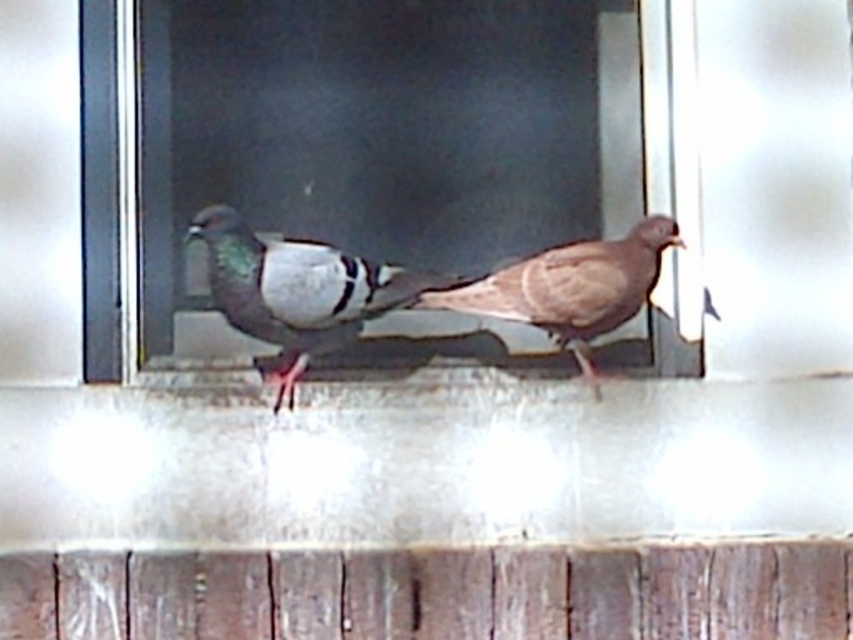
You are a birdwatcher observing two pigeons on a window ledge. You notice the speckled feathered pigeon at center and the brown feathered pigeon at center. Which pigeon is taller?

The speckled feathered pigeon at center is taller than the brown feathered pigeon at center.

Looking at this image, you are a bird enthusiast observing two pigeons on a window ledge. You notice a clear glass window at center and a speckled feathered pigeon at center. Which object is located to the left of the other?

The speckled feathered pigeon at center is located to the left of the clear glass window at center because the clear glass window at center is positioned on the right side of the speckled feathered pigeon at center.